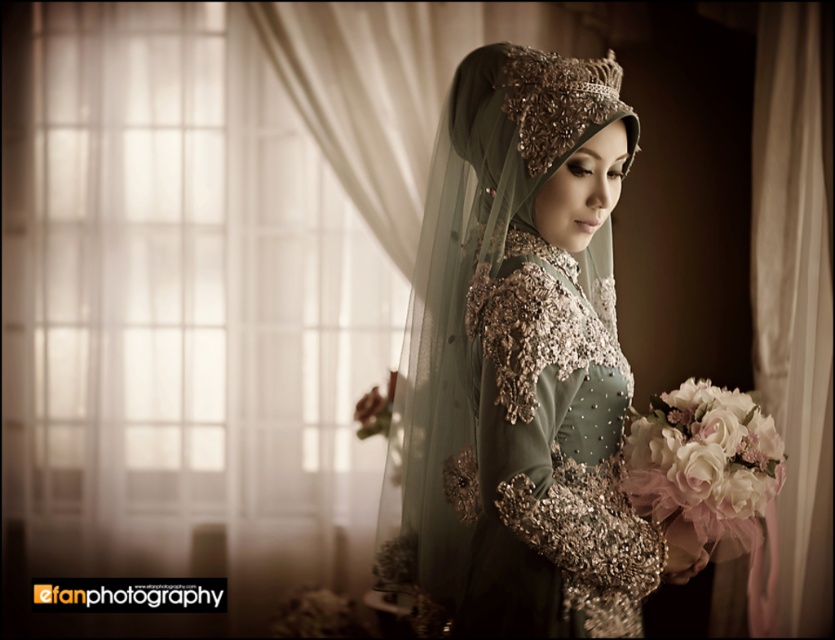
Which is in front, point (439, 621) or point (758, 317)?

Point (439, 621) is more forward.

Can you confirm if satin green dress at center is positioned to the left of white sheer curtain at right?

Correct, you'll find satin green dress at center to the left of white sheer curtain at right.

Between point (598, 540) and point (772, 611), which one is positioned in front?

Point (598, 540)

Locate an element on the screen. The image size is (835, 640). satin green dress at center is located at coordinates (x=519, y=369).

Which is above, satin shimmering dress at center or white sheer curtain at right?

white sheer curtain at right is above.

Between point (479, 310) and point (783, 326), which one is positioned behind?

Positioned behind is point (783, 326).

This screenshot has width=835, height=640. In order to click on satin shimmering dress at center in this screenshot , I will do `click(549, 460)`.

Who is lower down, satin green dress at center or satin shimmering dress at center?

satin shimmering dress at center is below.

Is point (469, 244) positioned behind point (488, 387)?

Yes, point (469, 244) is farther from viewer.

Locate an element on the screen. This screenshot has height=640, width=835. satin green dress at center is located at coordinates (519, 369).